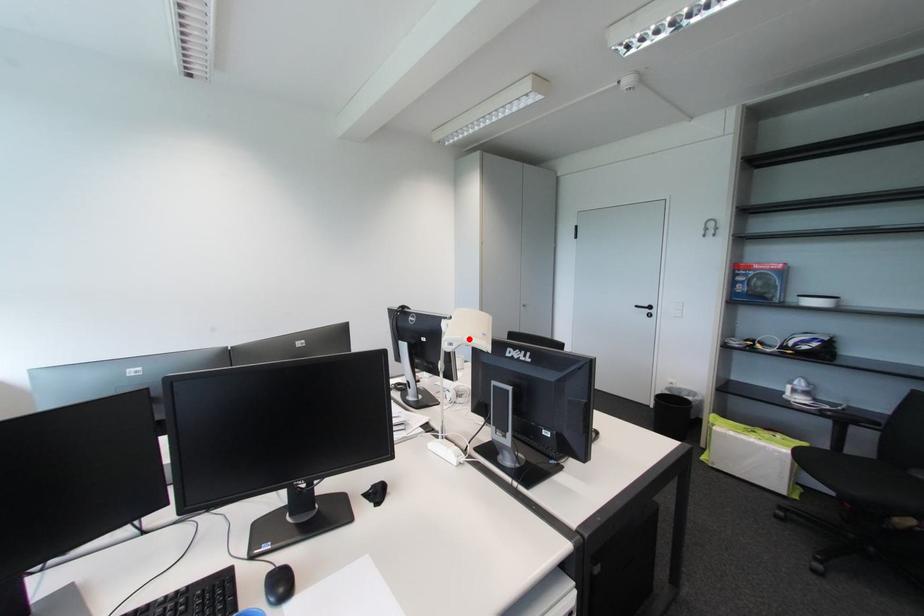
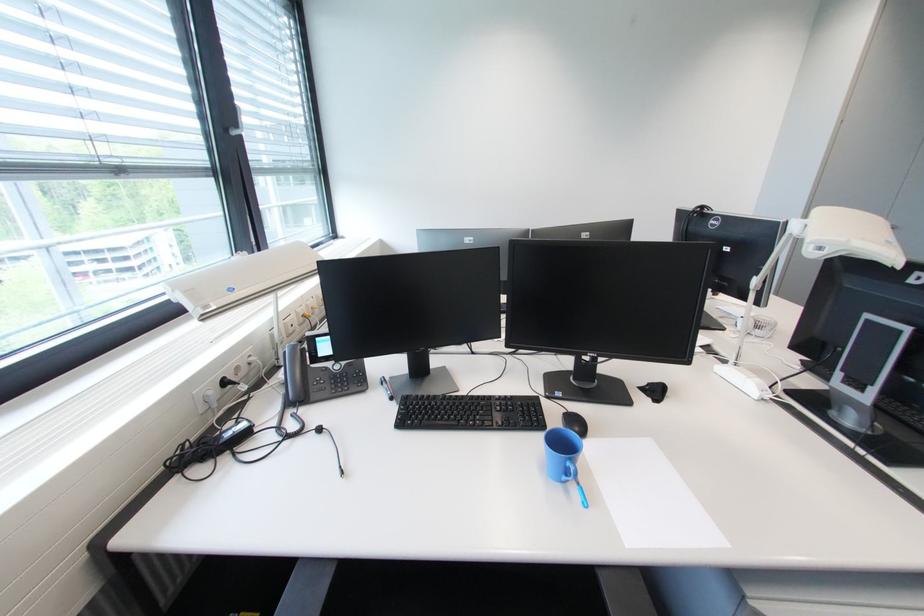
Question: I am providing you with two images of the same scene from different viewpoints. In image1, a red point is highlighted. Considering the same 3D point in image2, which of the following is correct?

Choices:
 (A) It is closer
 (B) It is farther

Answer: (A)